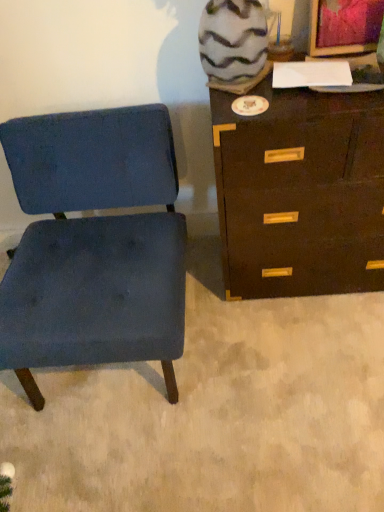
The height and width of the screenshot is (512, 384). I want to click on free point in front of dark brown wood chest of drawers at right, so click(306, 367).